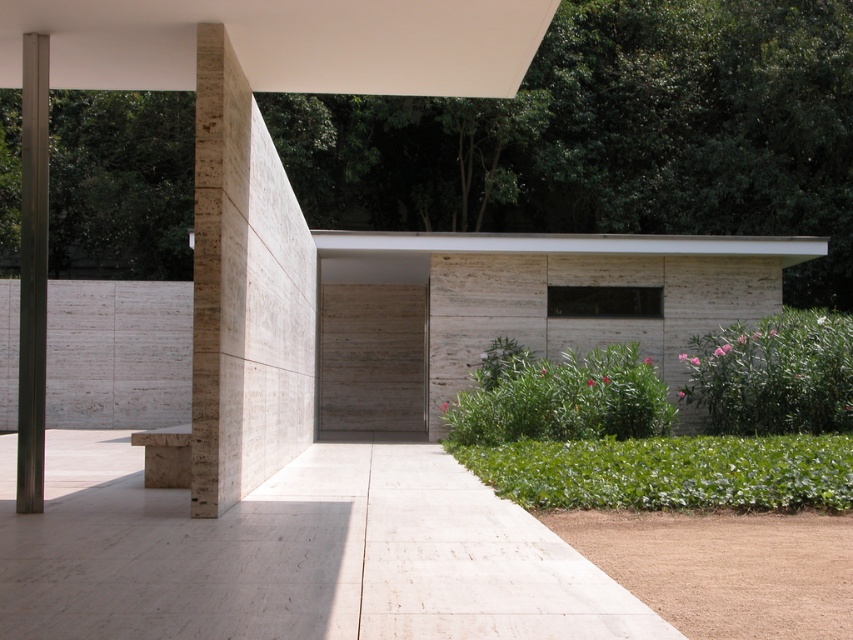
Question: Which object is the farthest from the metallic gray pole at left?

Choices:
 (A) white marble path at center
 (B) beige stone pillar at center

Answer: (B)

Question: Estimate the real-world distances between objects in this image. Which object is closer to the metallic gray pole at left?

Choices:
 (A) white marble path at center
 (B) beige stone pillar at center

Answer: (A)

Question: Considering the relative positions of white marble path at center and beige stone pillar at center in the image provided, where is white marble path at center located with respect to beige stone pillar at center?

Choices:
 (A) left
 (B) right

Answer: (B)

Question: Does white marble path at center appear on the right side of beige stone pillar at center?

Choices:
 (A) yes
 (B) no

Answer: (A)

Question: Can you confirm if white marble path at center is positioned below metallic gray pole at left?

Choices:
 (A) yes
 (B) no

Answer: (A)

Question: Which of the following is the farthest from the observer?

Choices:
 (A) (332, 492)
 (B) (207, 397)

Answer: (A)